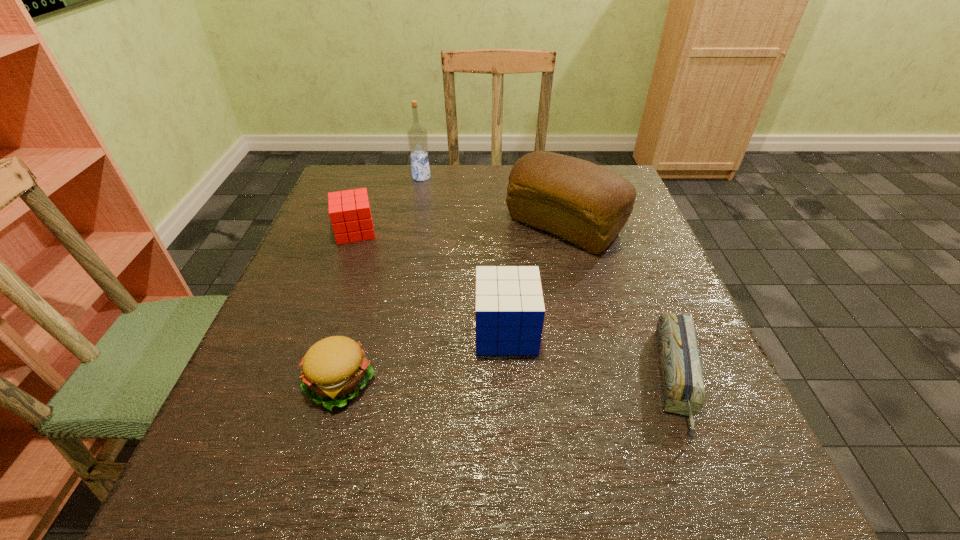
You are a GUI agent. You are given a task and a screenshot of the screen. Output one action in this format:
    pyautogui.click(x=<x>, y=<y>)
    Task: Click on the pencil box located in the right edge section of the desktop
    The image size is (960, 540).
    Given the screenshot: What is the action you would take?
    pyautogui.click(x=683, y=390)

The image size is (960, 540). Identify the location of object situated at the far right corner. (588, 205).

The image size is (960, 540). I want to click on free space at the far edge of the desktop, so click(425, 209).

Where is `vacant region at the near edge of the desktop`? vacant region at the near edge of the desktop is located at coordinates (304, 516).

Identify the location of vacant space at the left edge of the desktop. The height and width of the screenshot is (540, 960). (284, 361).

In the image, there is a desktop. Where is `free space at the right edge`? The image size is (960, 540). free space at the right edge is located at coordinates (658, 409).

At what (x,y) coordinates should I click in order to perform the action: click on vacant space at the far left corner. Please return your answer as a coordinate pair (x, y). The width and height of the screenshot is (960, 540). Looking at the image, I should click on (384, 168).

Identify the location of free space at the far right corner. This screenshot has width=960, height=540. (621, 172).

Where is `free space at the near right corner`? free space at the near right corner is located at coordinates (727, 512).

I want to click on vacant space that's between the farthest object and the nearer cube, so click(464, 254).